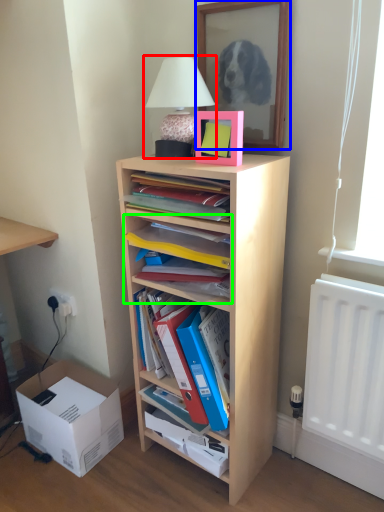
Question: Based on their relative distances, which object is farther from table lamp (highlighted by a red box)? Choose from mirror (highlighted by a blue box) and shelf (highlighted by a green box).

Choices:
 (A) mirror
 (B) shelf

Answer: (B)